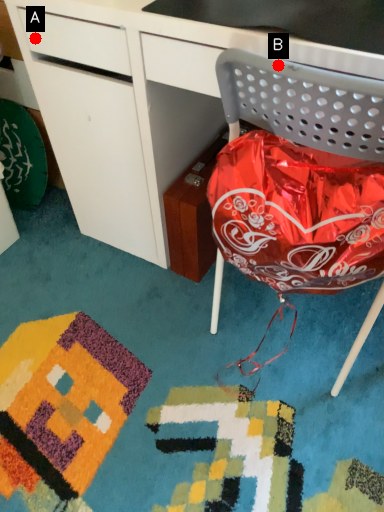
Question: Two points are circled on the image, labeled by A and B beside each circle. Which point appears closest to the camera in this image?

Choices:
 (A) A is closer
 (B) B is closer

Answer: (B)